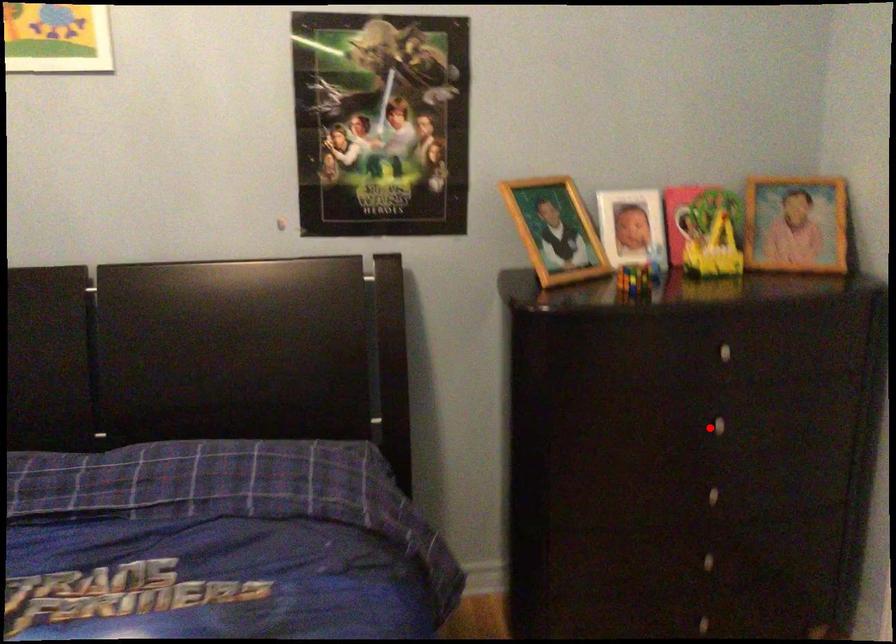
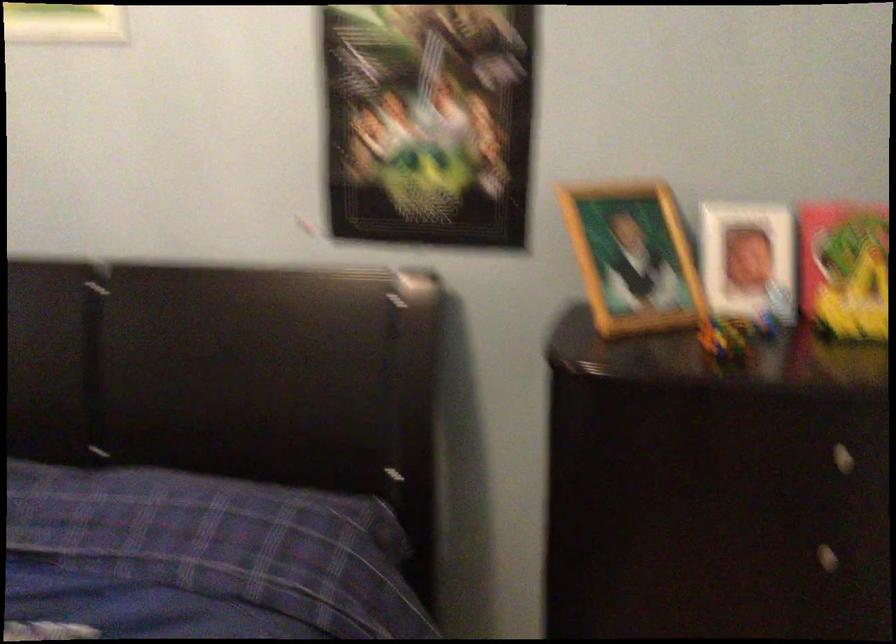
Find the pixel in the second image that matches the highlighted location in the first image.

(807, 554)